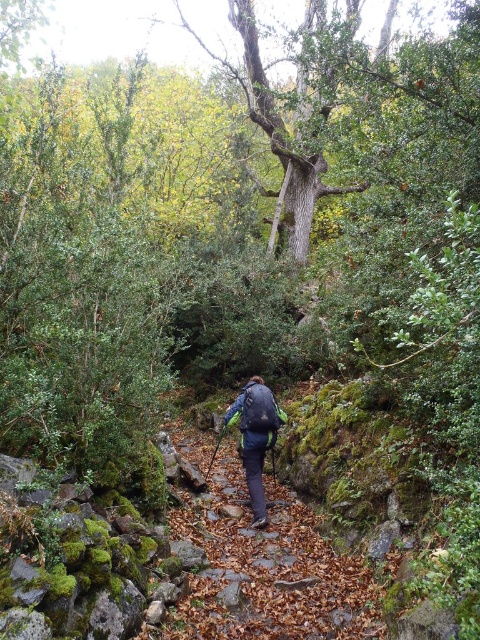
Question: Is green fabric backpack at center above matte blue backpack at center?

Choices:
 (A) no
 (B) yes

Answer: (A)

Question: Which of the following is the closest to the observer?

Choices:
 (A) green fabric backpack at center
 (B) matte blue backpack at center
 (C) brown leafy trail at center

Answer: (C)

Question: Is green fabric backpack at center wider than matte blue backpack at center?

Choices:
 (A) yes
 (B) no

Answer: (A)

Question: Considering the real-world distances, which object is farthest from the green fabric backpack at center?

Choices:
 (A) brown leafy trail at center
 (B) matte blue backpack at center

Answer: (A)

Question: Which point appears farthest from the camera in this image?

Choices:
 (A) click(264, 424)
 (B) click(273, 396)
 (C) click(303, 577)

Answer: (B)

Question: Can you confirm if brown leafy trail at center is bigger than green fabric backpack at center?

Choices:
 (A) yes
 (B) no

Answer: (A)